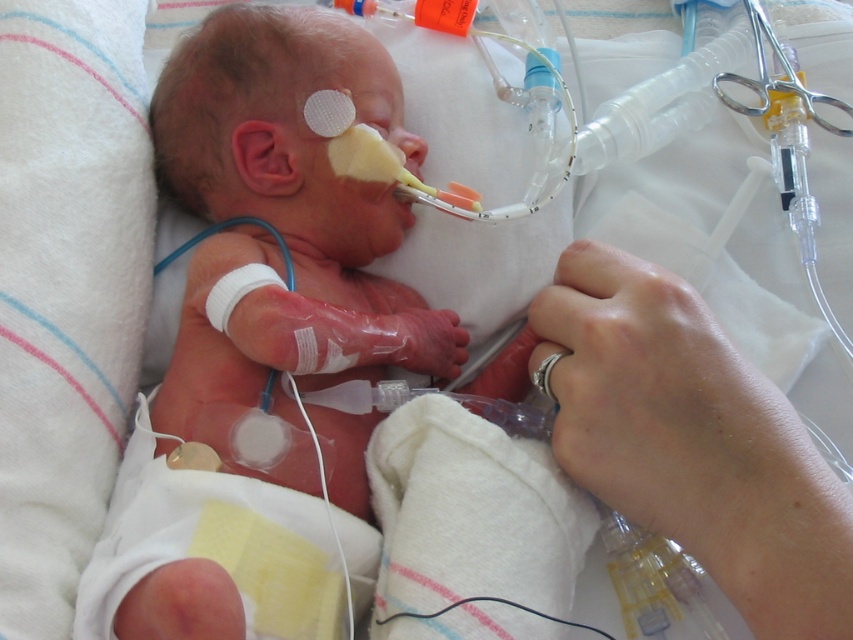
You are a nurse in the NICU unit. You need to choose an object to use for the baby that requires something narrow enough to fit into a small opening. Which object should you choose between the clear plastic tube at lower right and the silver metallic teething ring at lower center?

The silver metallic teething ring at lower center should be chosen because its width is smaller than the clear plastic tube at lower right, making it more suitable for fitting into a small opening.